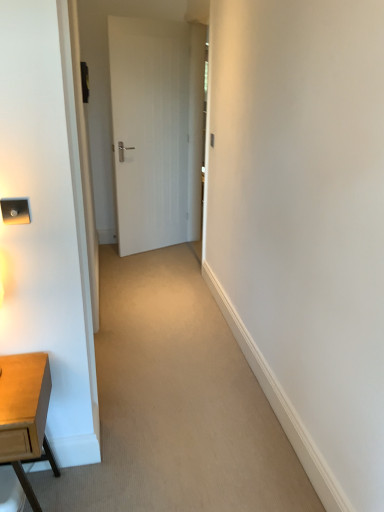
Question: From a real-world perspective, relative to light brown wooden desk at lower left, is white wood door at center vertically above or below?

Choices:
 (A) below
 (B) above

Answer: (B)

Question: In the image, is white wood door at center on the left side or the right side of light brown wooden desk at lower left?

Choices:
 (A) right
 (B) left

Answer: (A)

Question: From the image's perspective, is white wood door at center located above or below light brown wooden desk at lower left?

Choices:
 (A) below
 (B) above

Answer: (B)

Question: Is light brown wooden desk at lower left in front of or behind white wood door at center in the image?

Choices:
 (A) front
 (B) behind

Answer: (A)

Question: From the image's perspective, is light brown wooden desk at lower left located above or below white wood door at center?

Choices:
 (A) below
 (B) above

Answer: (A)

Question: Looking at the image, does light brown wooden desk at lower left seem bigger or smaller compared to white wood door at center?

Choices:
 (A) small
 (B) big

Answer: (A)

Question: Is light brown wooden desk at lower left taller or shorter than white wood door at center?

Choices:
 (A) short
 (B) tall

Answer: (A)